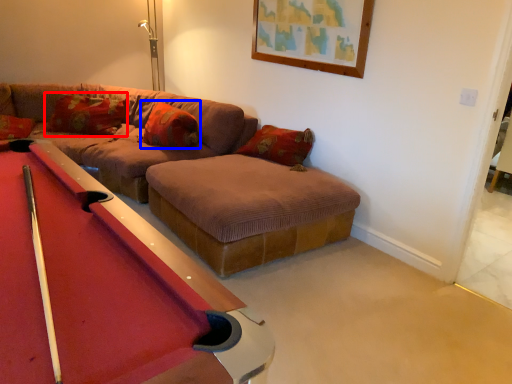
Question: Which point is further to the camera, pillow (highlighted by a red box) or pillow (highlighted by a blue box)?

Choices:
 (A) pillow
 (B) pillow

Answer: (A)